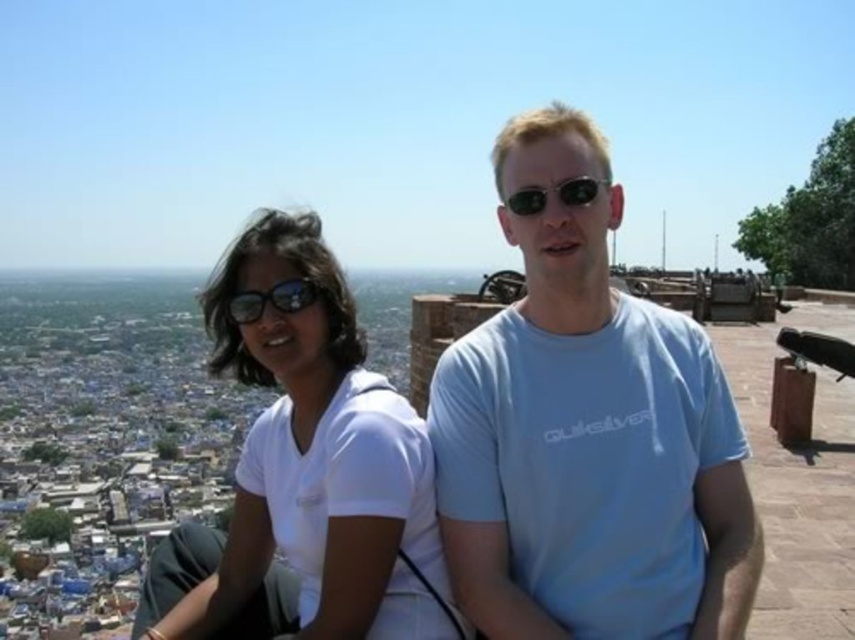
Does point (700, 420) lie behind point (243, 584)?

That is False.

Is point (491, 381) behind point (358, 618)?

Yes, point (491, 381) is farther from viewer.

The image size is (855, 640). Find the location of `light blue cotton t-shirt at center`. light blue cotton t-shirt at center is located at coordinates (587, 435).

From the picture: Is matte black goggles at upper left wider than black reflective sunglasses at center?

No.

Where is `matte black goggles at upper left`? This screenshot has height=640, width=855. matte black goggles at upper left is located at coordinates (272, 300).

Describe the element at coordinates (272, 300) in the screenshot. Image resolution: width=855 pixels, height=640 pixels. I see `matte black goggles at upper left` at that location.

Find the location of a particular element. matte black goggles at upper left is located at coordinates (272, 300).

Does white matte t-shirt at center appear over black reflective sunglasses at center?

Incorrect, white matte t-shirt at center is not positioned above black reflective sunglasses at center.

Does white matte t-shirt at center appear under black reflective sunglasses at center?

Yes.

At what (x,y) coordinates should I click in order to perform the action: click on white matte t-shirt at center. Please return your answer as a coordinate pair (x, y). The width and height of the screenshot is (855, 640). Looking at the image, I should click on (305, 474).